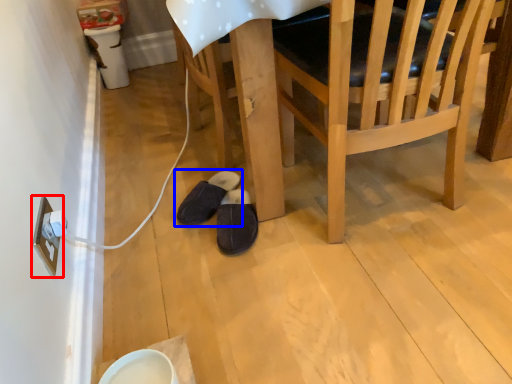
Question: Which point is closer to the camera, electric outlet (highlighted by a red box) or footwear (highlighted by a blue box)?

Choices:
 (A) electric outlet
 (B) footwear

Answer: (A)